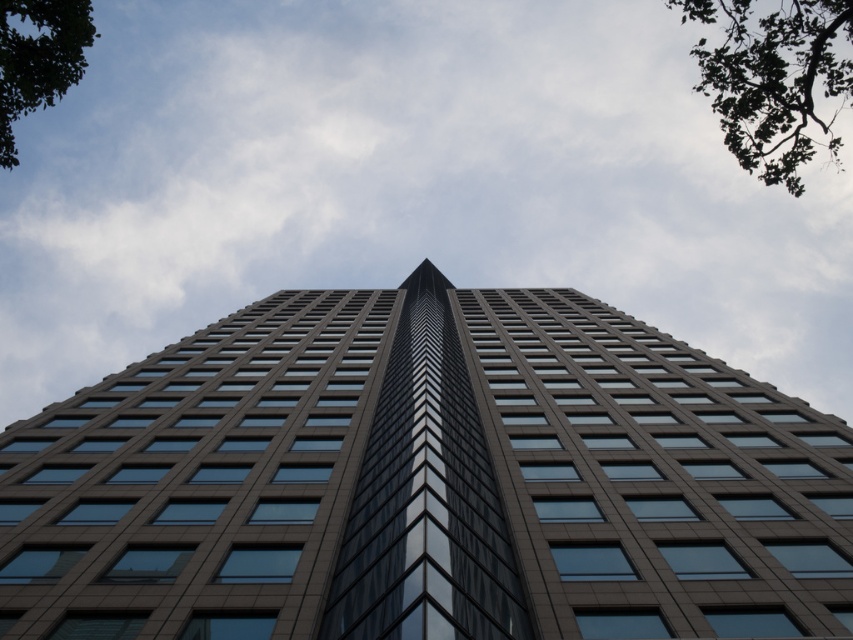
You are standing at the base of the skyscraper and looking up. There are two points marked on the building. One is at coordinate point (708, 80) and the other at point (44, 86). Which point is higher up on the building?

Point (708, 80) is higher up on the building than point (44, 86) because it is located behind it, indicating a higher elevation.

You are standing in front of the skyscraper and notice two green leafy trees in the background. Which tree is closer to you, the green leafy tree at upper right or the green leafy tree at upper left?

The green leafy tree at upper right is closer to you because it is further to the viewer than the green leafy tree at upper left.

You are standing at the base of the smooth glass tower at center. If you look directly upward, will your gaze align with the central triangular section of the tower?

The smooth glass tower at center is located at point coordinates that place its central triangular section directly in line with the center point of the image. Since you are standing at the base, looking directly upward would align your gaze with the central triangular section of the tower.